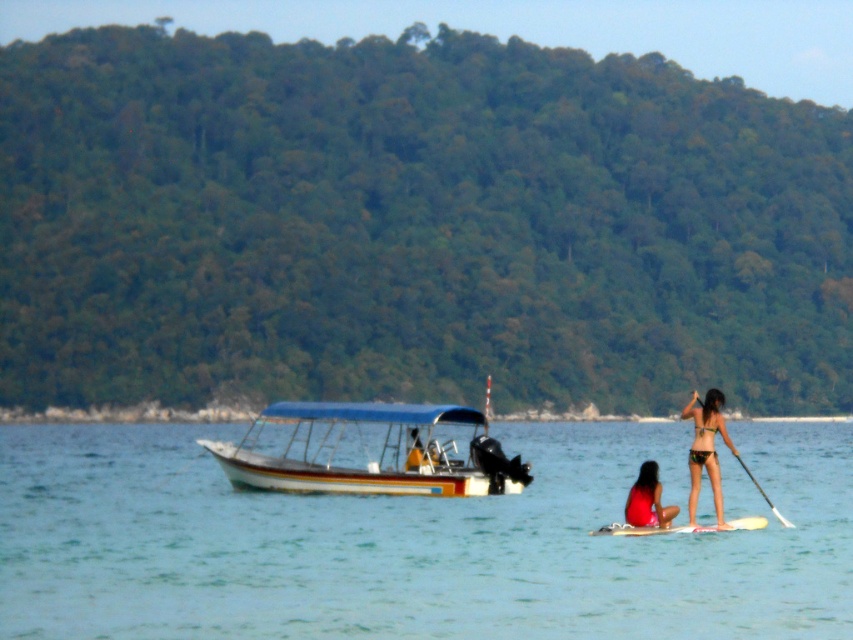
You are a swimmer who wants to grab the white glossy paddle at right from your current position near the matte red swimsuit at lower center. Can you reach it without moving your feet?

The matte red swimsuit at lower center is 3.18 meters away from the white glossy paddle at right. Since 3.18 meters is a considerable distance, you cannot reach the white glossy paddle at right without moving your feet.